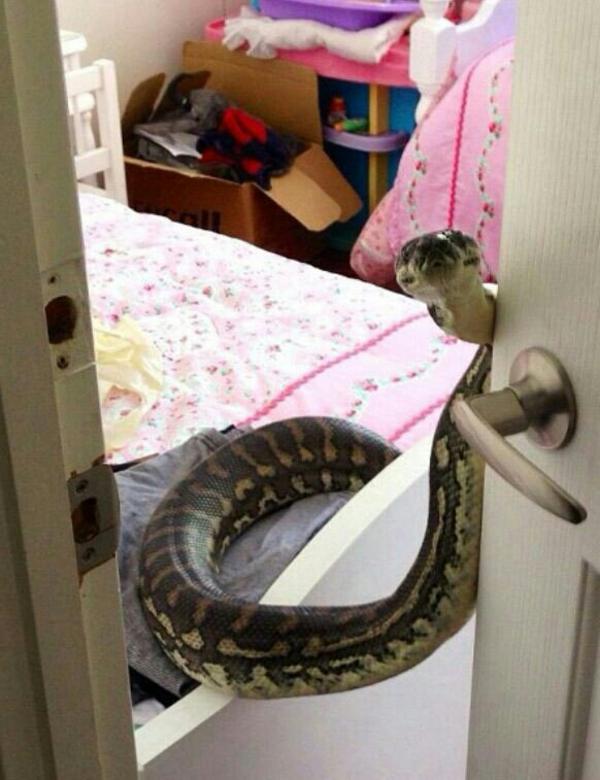
The image size is (600, 780). Identify the location of folded clothes. (260, 543).